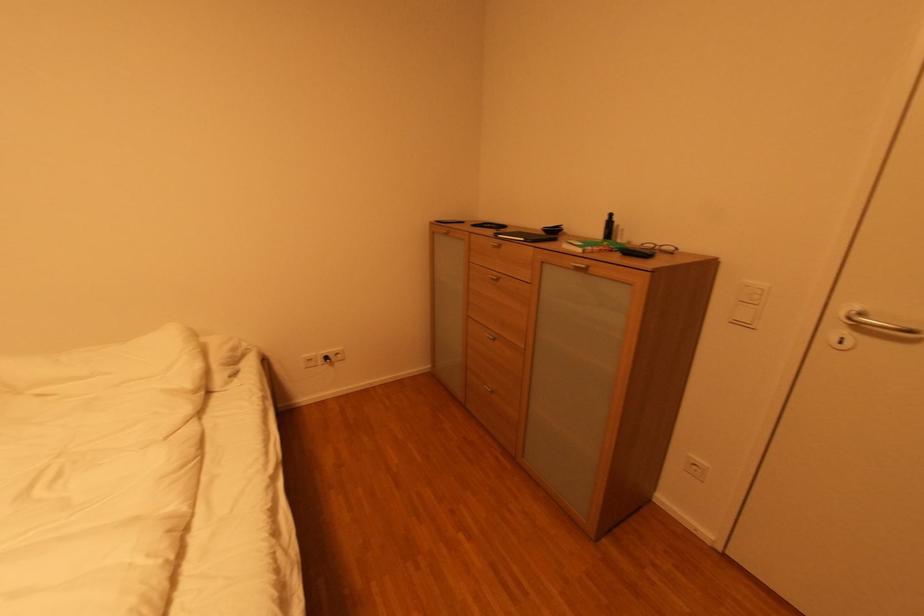
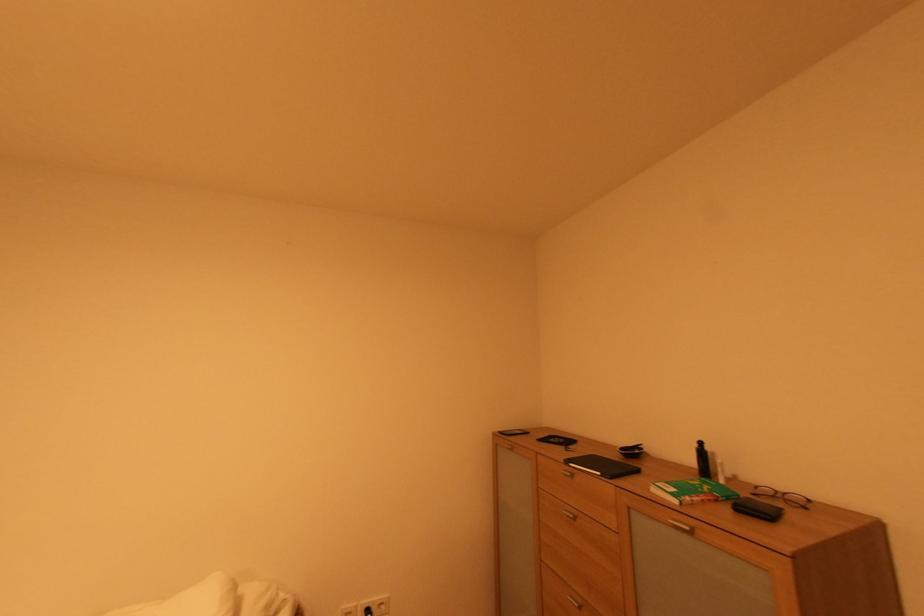
Locate, in the second image, the point that corresponds to (x=586, y=252) in the first image.

(682, 503)